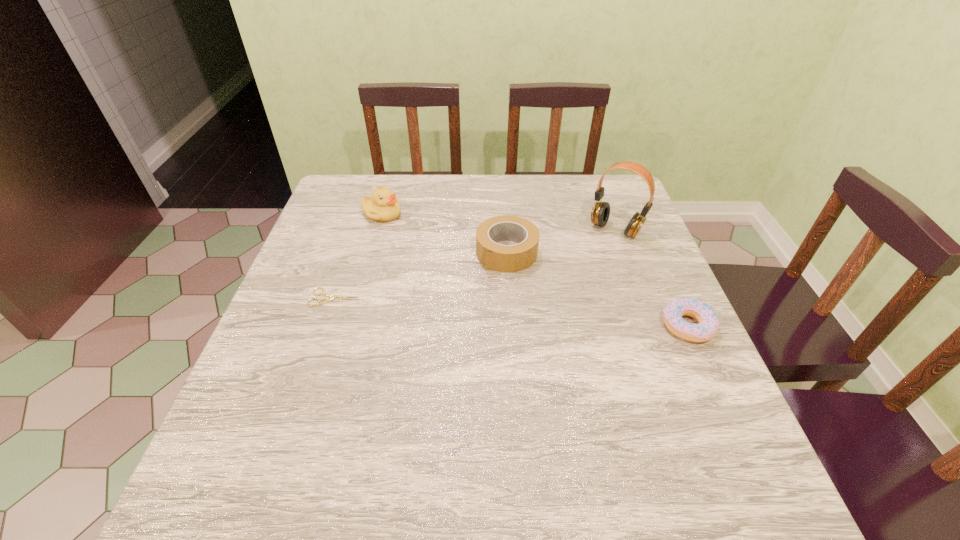
Locate an element on the screen. The image size is (960, 540). the second nearest object is located at coordinates pyautogui.click(x=325, y=300).

Find the location of a particular element. The height and width of the screenshot is (540, 960). the shortest object is located at coordinates (325, 300).

The height and width of the screenshot is (540, 960). Find the location of `doughnut`. doughnut is located at coordinates (708, 321).

I want to click on the fourth tallest object, so (708, 321).

Identify the location of the second tallest object. (383, 206).

This screenshot has height=540, width=960. I want to click on the tallest object, so click(600, 213).

I want to click on the third tallest object, so click(505, 258).

What are the coordinates of `the third object from right to left` in the screenshot? It's located at (505, 258).

This screenshot has width=960, height=540. Find the location of `vacant space situated on the right of the shortest object`. vacant space situated on the right of the shortest object is located at coordinates (512, 298).

The image size is (960, 540). Identify the location of vacant space located 0.200m on the front of the nearest object. (738, 438).